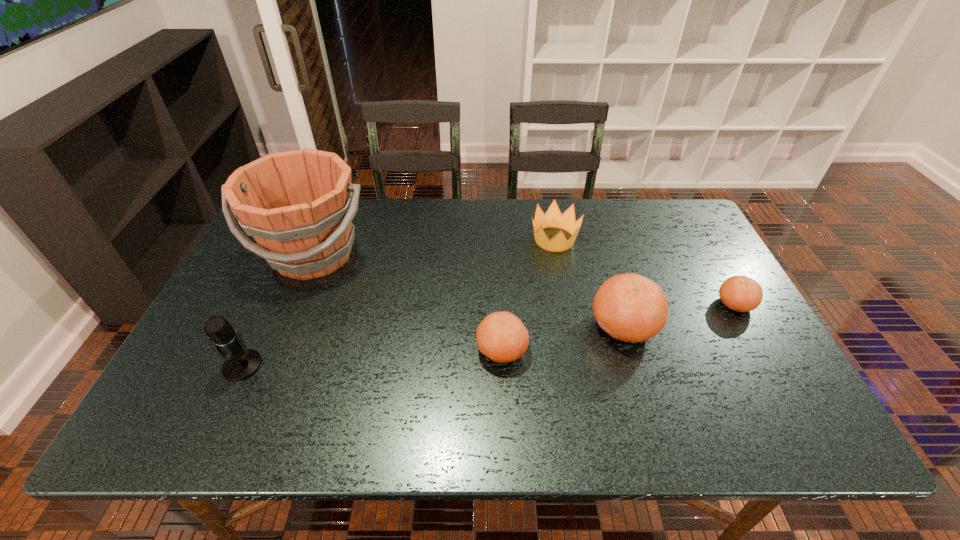
Locate an element on the screen. This screenshot has height=540, width=960. vacant point located 0.320m on the left of the second clementine from left to right is located at coordinates (465, 326).

The image size is (960, 540). In order to click on free location located on the left of the shortest clementine in this screenshot , I will do `click(574, 304)`.

Locate an element on the screen. This screenshot has height=540, width=960. free space located 0.250m on the handle side of the bucket is located at coordinates (266, 369).

Where is `free space located on the left of the crown`? This screenshot has height=540, width=960. free space located on the left of the crown is located at coordinates (465, 239).

Where is `vacant point located 0.060m on the left of the microphone`? This screenshot has height=540, width=960. vacant point located 0.060m on the left of the microphone is located at coordinates (199, 366).

I want to click on bucket located at the far edge, so click(x=298, y=205).

You are a GUI agent. You are given a task and a screenshot of the screen. Output one action in this format:
    pyautogui.click(x=<x>, y=<y>)
    Task: Click on the crown situated at the far edge
    The image size is (960, 540).
    Given the screenshot: What is the action you would take?
    pyautogui.click(x=553, y=218)

Where is `clementine that is at the near edge`? This screenshot has width=960, height=540. clementine that is at the near edge is located at coordinates (501, 336).

I want to click on microphone that is at the near edge, so click(x=239, y=364).

Image resolution: width=960 pixels, height=540 pixels. Find the location of `bucket that is at the left edge`. bucket that is at the left edge is located at coordinates (298, 205).